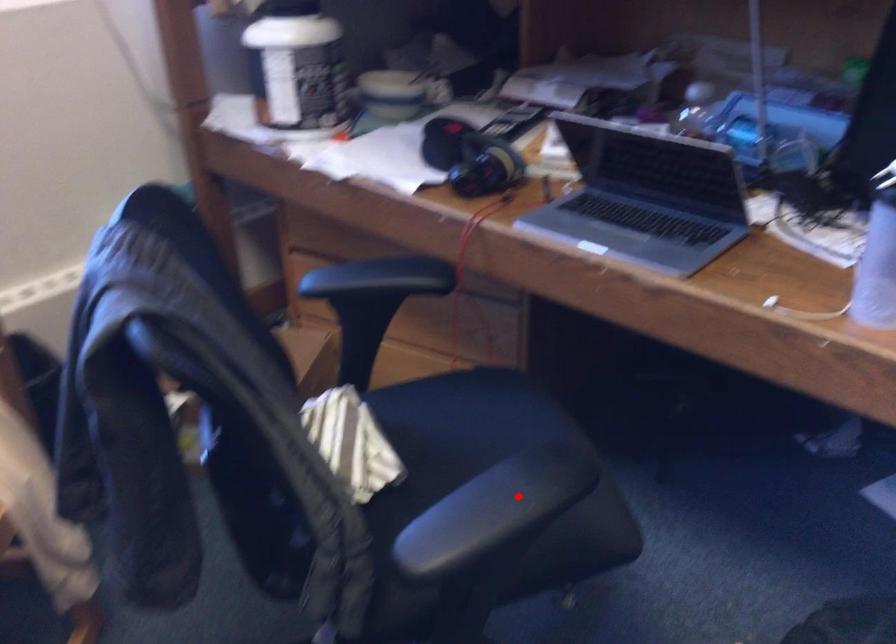
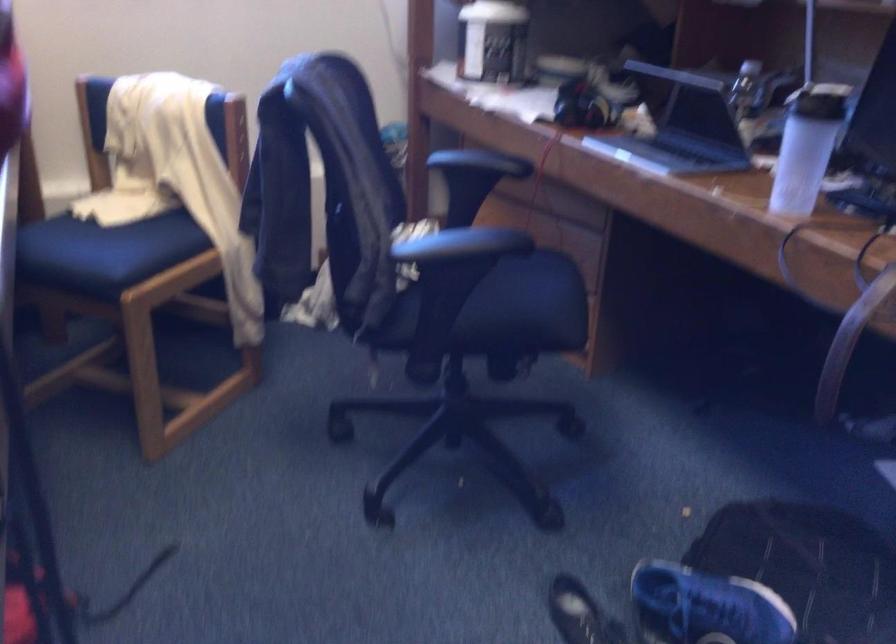
In the second image, find the point that corresponds to the highlighted location in the first image.

(471, 242)